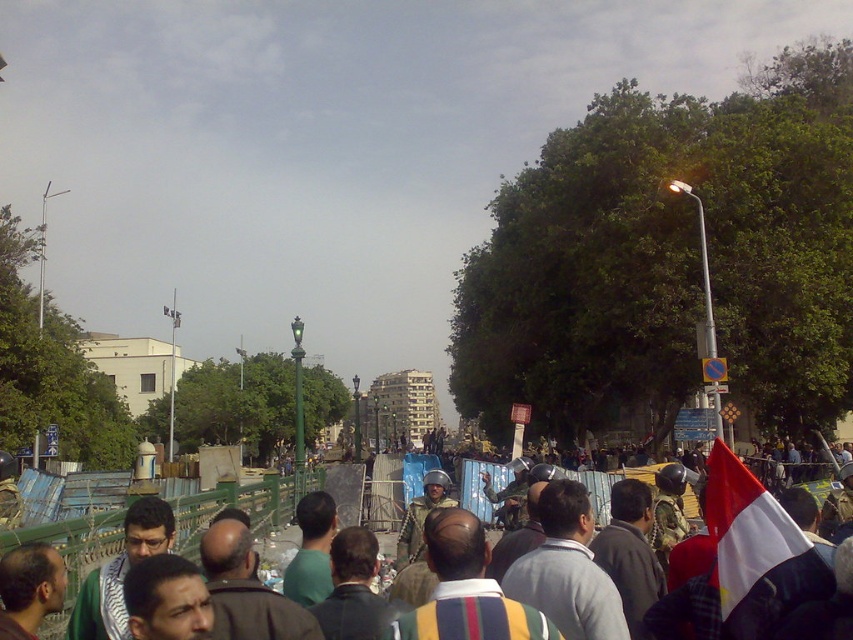
You are a photographer trying to capture a clear shot of both the striped shirt at center and the white fabric flag at right. Which object should you focus on first if you want to ensure both are in focus without adjusting your camera settings?

You should focus on the striped shirt at center first because it is larger in size compared to the white fabric flag at right, making it easier to achieve focus on the larger object before adjusting for the smaller one.

You are a photographer standing at the center of the scene. You want to take a photo that includes both the point at coordinates point (107, 513) and point (756, 522). Since you have a limited depth of field, which point should you focus on to ensure both points are in focus?

To ensure both points are in focus, you should focus on the point that is halfway between point (107, 513) and point (756, 522). However, since point (107, 513) is closer to the camera than point (756, 522), focusing on the midpoint might not be possible. Alternatively, you could focus on the closer point, point (107, 513), and use a smaller aperture to maximize depth of field, ensuring both points are sharp.